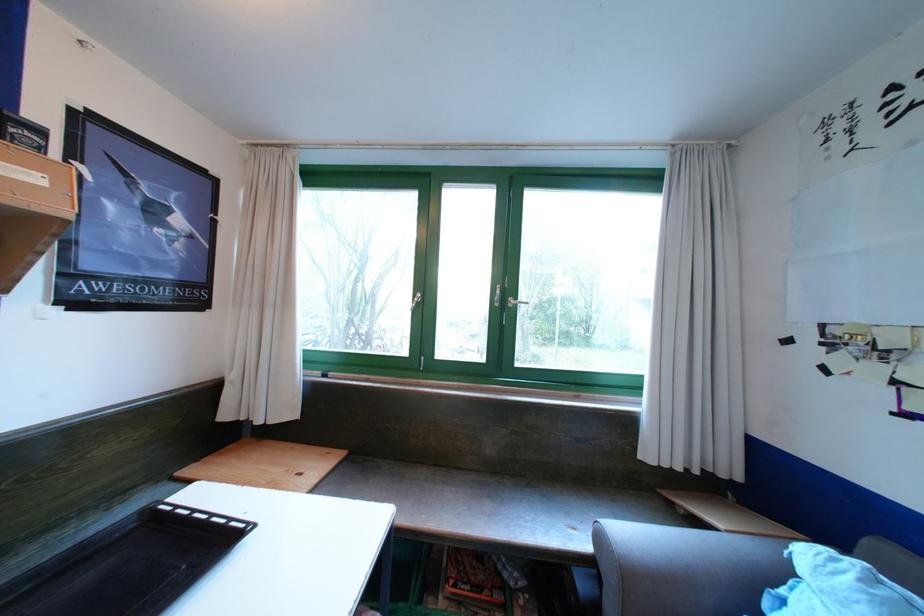
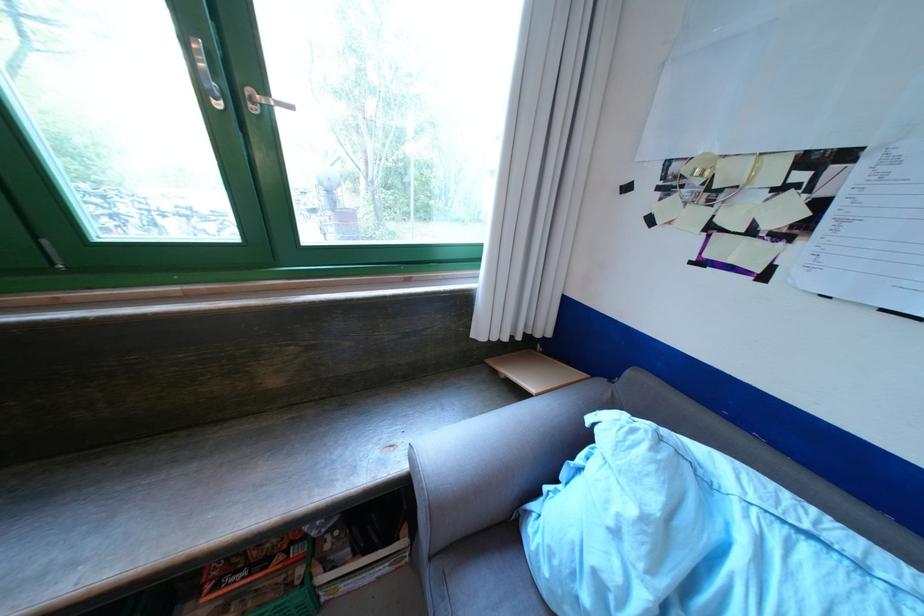
First-person continuous shooting, in which direction is the camera rotating?

The camera rotated toward right-down.